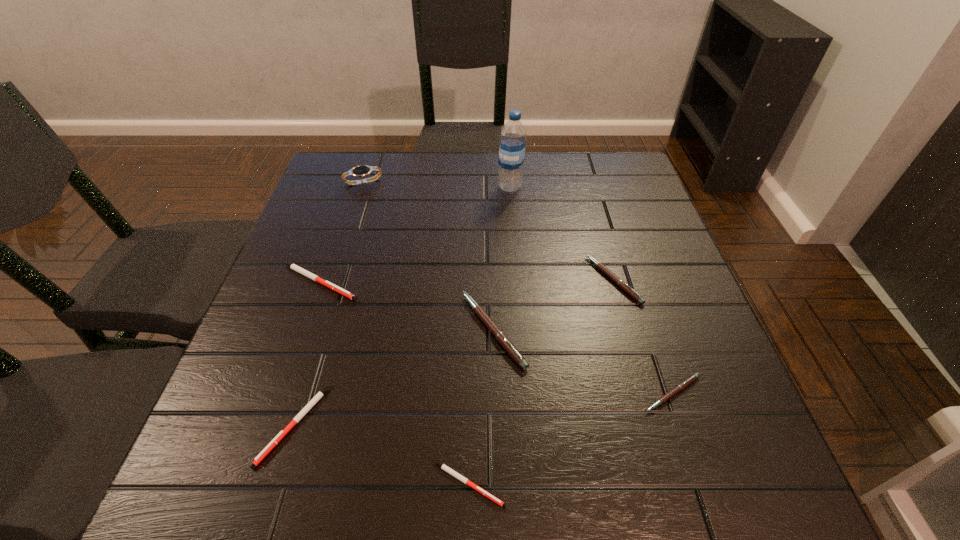
Choose which white pen is the third nearest neighbor to the nearest pink pen. Please provide its 2D coordinates. Your answer should be formatted as a tuple, i.e. [(x, y)], where the tuple contains the x and y coordinates of a point satisfying the conditions above.

[(294, 267)]

Select which white pen is the second closest to the seventh shortest object. Please provide its 2D coordinates. Your answer should be formatted as a tuple, i.e. [(x, y)], where the tuple contains the x and y coordinates of a point satisfying the conditions above.

[(318, 396)]

Identify the location of vacant space that satisfies the following two spatial constraints: 1. at the nib of the second biggest pink pen; 2. on the clicker of the second smallest white pen. This screenshot has height=540, width=960. (656, 424).